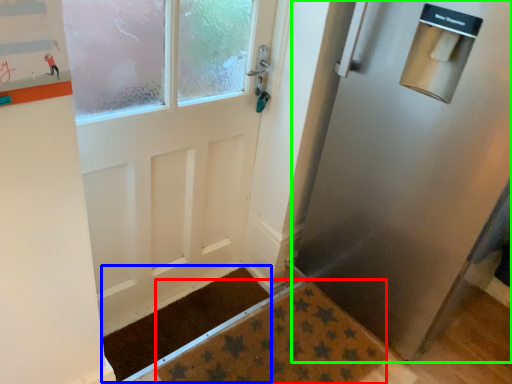
Question: Considering the real-world distances, which object is farthest from doormat (highlighted by a red box)? doormat (highlighted by a blue box) or door (highlighted by a green box)?

Choices:
 (A) doormat
 (B) door

Answer: (B)